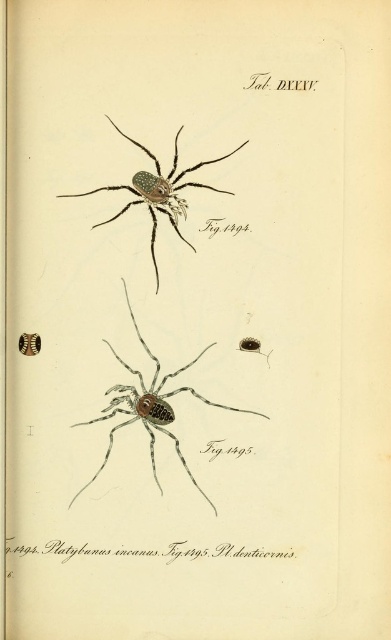
Question: Which object appears farthest from the camera in this image?

Choices:
 (A) shiny metallic spider at upper center
 (B) brown matte spider at center

Answer: (B)

Question: Does brown matte spider at center appear over shiny metallic spider at upper center?

Choices:
 (A) yes
 (B) no

Answer: (B)

Question: Which point is farther to the camera?

Choices:
 (A) pyautogui.click(x=163, y=396)
 (B) pyautogui.click(x=148, y=205)

Answer: (A)

Question: Which of the following is the farthest from the observer?

Choices:
 (A) (173, 198)
 (B) (184, 388)

Answer: (B)

Question: Can you confirm if brown matte spider at center is wider than shiny metallic spider at upper center?

Choices:
 (A) yes
 (B) no

Answer: (A)

Question: Does brown matte spider at center have a lesser width compared to shiny metallic spider at upper center?

Choices:
 (A) no
 (B) yes

Answer: (A)